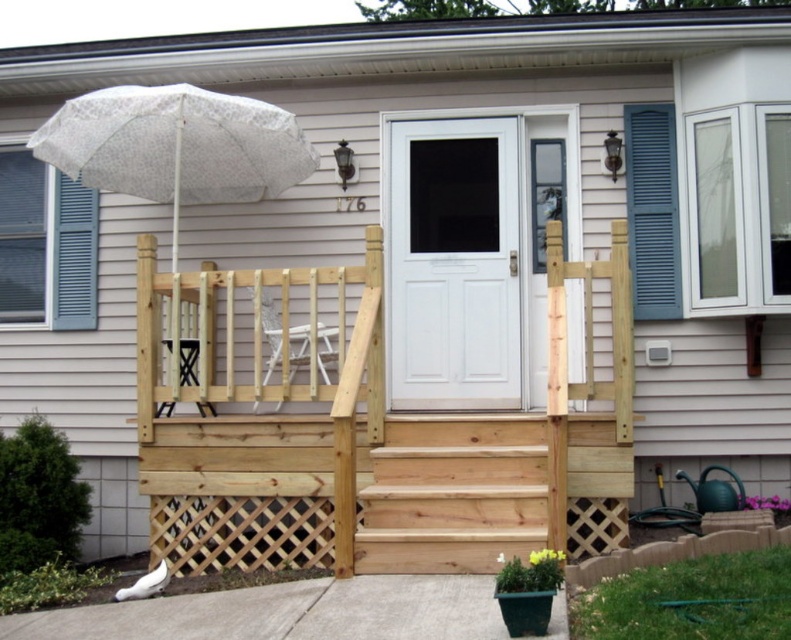
Question: Can you confirm if natural wood porch at center is positioned to the right of white painted wood door at center?

Choices:
 (A) yes
 (B) no

Answer: (B)

Question: Can you confirm if white painted wood door at center is wider than natural wood stairs at center?

Choices:
 (A) yes
 (B) no

Answer: (B)

Question: Considering the real-world distances, which object is closest to the white lace umbrella at upper left?

Choices:
 (A) natural wood stairs at center
 (B) natural wood porch at center

Answer: (B)

Question: Among these objects, which one is farthest from the camera?

Choices:
 (A) white painted wood door at center
 (B) natural wood stairs at center
 (C) natural wood porch at center

Answer: (A)

Question: Can you confirm if white painted wood door at center is positioned above natural wood stairs at center?

Choices:
 (A) yes
 (B) no

Answer: (A)

Question: Which object is closer to the camera taking this photo?

Choices:
 (A) natural wood stairs at center
 (B) white painted wood door at center

Answer: (A)